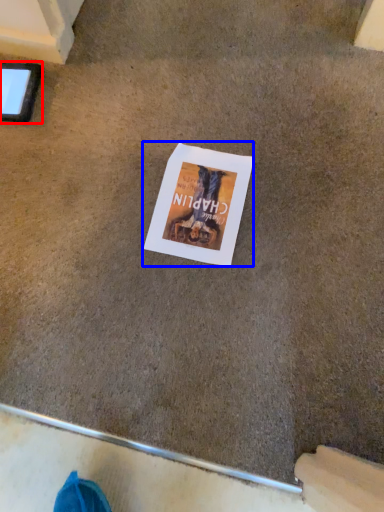
Question: Which object appears closest to the camera in this image, tablet computer (highlighted by a red box) or flyer (highlighted by a blue box)?

Choices:
 (A) tablet computer
 (B) flyer

Answer: (B)